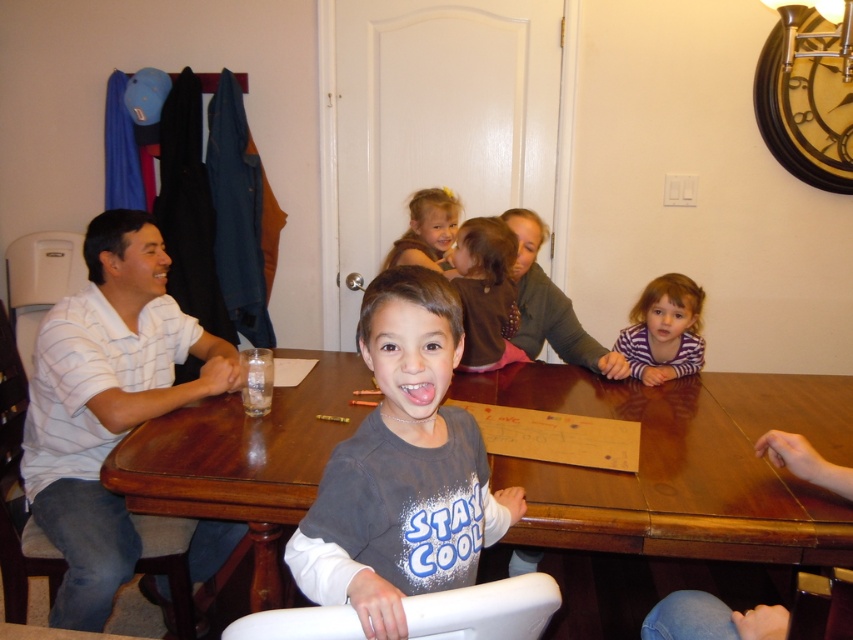
Which is more to the right, smooth brown hair at upper center or pink glossy tongue at center?

pink glossy tongue at center

Is point (418, 253) positioned in front of point (399, 394)?

No, it is behind (399, 394).

Where is `smooth brown hair at upper center`? This screenshot has width=853, height=640. smooth brown hair at upper center is located at coordinates (427, 228).

Can you confirm if brown wooden table at center is positioned above smooth brown hair at upper center?

No, brown wooden table at center is not above smooth brown hair at upper center.

Between brown wooden table at center and smooth brown hair at upper center, which one is positioned higher?

smooth brown hair at upper center

Locate an element on the screen. brown wooden table at center is located at coordinates (682, 465).

Between gray cotton shirt at center and smooth brown hair at upper center, which one is positioned lower?

gray cotton shirt at center is below.

Does gray cotton shirt at center have a lesser width compared to smooth brown hair at upper center?

Incorrect, gray cotton shirt at center's width is not less than smooth brown hair at upper center's.

The width and height of the screenshot is (853, 640). I want to click on gray cotton shirt at center, so click(x=402, y=470).